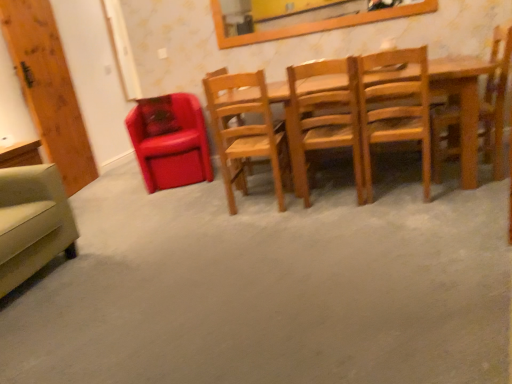
Locate an element on the screen. vacant space that is to the left of wooden chair at center, marked as the fourth chair in a right-to-left arrangement is located at coordinates (203, 210).